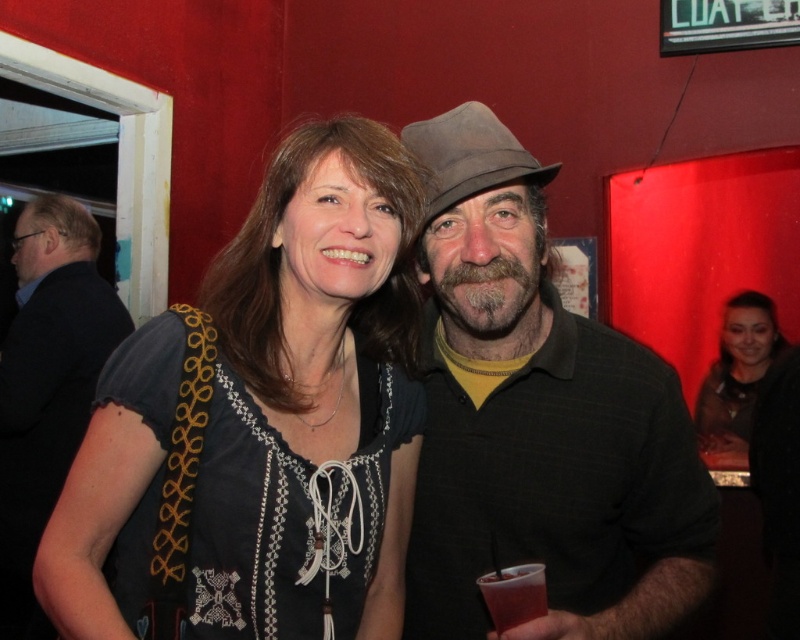
Between smooth brown hair at center and translucent plastic cup at lower right, which one appears on the left side from the viewer's perspective?

From the viewer's perspective, translucent plastic cup at lower right appears more on the left side.

Which is behind, point (758, 388) or point (517, 577)?

Positioned behind is point (758, 388).

Consider the image. Who is more forward, (696, 410) or (501, 586)?

Point (501, 586) is more forward.

Identify the location of smooth brown hair at center. (736, 378).

Does graywoollybeard at center have a smaller size compared to translucent plastic cup at lower right?

Incorrect, graywoollybeard at center is not smaller in size than translucent plastic cup at lower right.

Between point (438, 259) and point (496, 605), which one is positioned behind?

The point (438, 259) is more distant.

At what (x,y) coordinates should I click in order to perform the action: click on graywoollybeard at center. Please return your answer as a coordinate pair (x, y). Looking at the image, I should click on [488, 285].

Does dark green textured shirt at center lie in front of graywoollybeard at center?

Yes.

Which is above, dark green textured shirt at center or graywoollybeard at center?

Positioned higher is graywoollybeard at center.

Is point (458, 196) positioned before point (502, 307)?

Yes, it is in front of point (502, 307).

The width and height of the screenshot is (800, 640). What are the coordinates of `dark green textured shirt at center` in the screenshot? It's located at (540, 420).